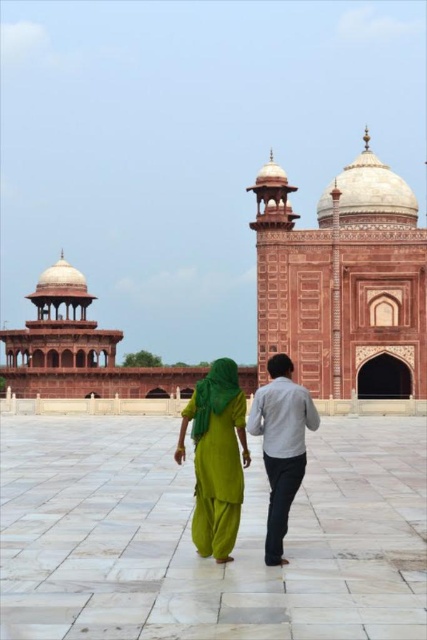
Question: Which of the following is the closest to the observer?

Choices:
 (A) (421, 250)
 (B) (239, 488)

Answer: (B)

Question: Observing the image, what is the correct spatial positioning of marble dome at center in reference to green fabric dress at center?

Choices:
 (A) right
 (B) left

Answer: (A)

Question: Can you confirm if marble dome at center is smaller than green fabric dress at center?

Choices:
 (A) yes
 (B) no

Answer: (B)

Question: Among these objects, which one is farthest from the camera?

Choices:
 (A) marble dome at center
 (B) green fabric dress at center

Answer: (A)

Question: Is marble dome at center to the left of green fabric dress at center from the viewer's perspective?

Choices:
 (A) no
 (B) yes

Answer: (A)

Question: Which of the following is the farthest from the observer?

Choices:
 (A) (269, 202)
 (B) (213, 460)

Answer: (A)